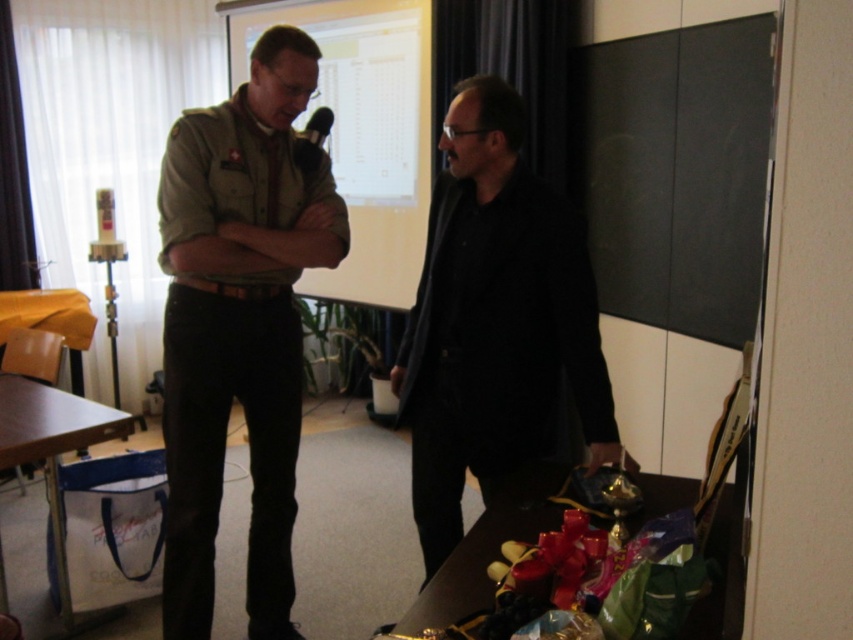
Which is in front, point (635, 467) or point (715, 614)?

Point (715, 614) is in front.

Can you confirm if black matte jacket at center is positioned to the right of shiny metallic table at lower right?

In fact, black matte jacket at center is to the left of shiny metallic table at lower right.

The height and width of the screenshot is (640, 853). What do you see at coordinates (494, 321) in the screenshot?
I see `black matte jacket at center` at bounding box center [494, 321].

This screenshot has height=640, width=853. I want to click on black matte jacket at center, so (x=494, y=321).

Between satin khaki shirt at center and black matte jacket at center, which one is positioned lower?

Positioned lower is satin khaki shirt at center.

Is point (194, 116) farther from camera compared to point (560, 298)?

Yes, point (194, 116) is farther from viewer.

I want to click on satin khaki shirt at center, so click(x=238, y=324).

Based on the photo, is shiny metallic table at lower right taller than metallic silver microphone at upper center?

Indeed, shiny metallic table at lower right has a greater height compared to metallic silver microphone at upper center.

Locate an element on the screen. This screenshot has width=853, height=640. shiny metallic table at lower right is located at coordinates (480, 557).